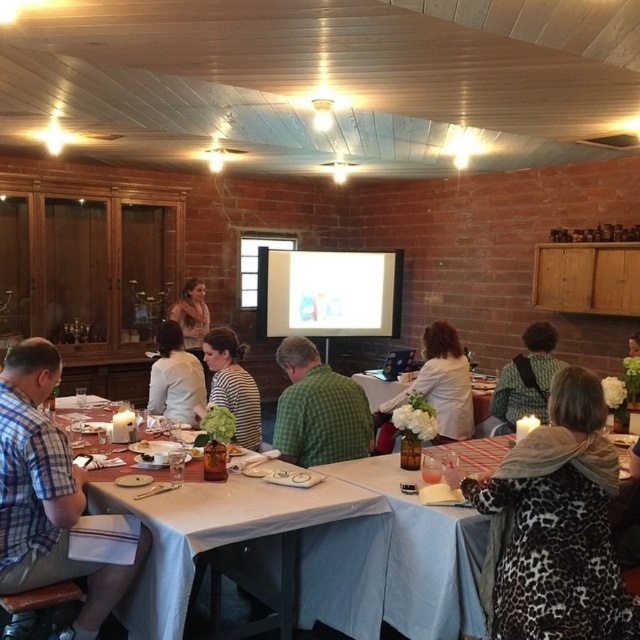
You are standing in the conference room and need to locate the person wearing the white shirt at center. According to the coordinates provided, where exactly is this person positioned?

The white shirt at center is located at point (173, 378), which means it is positioned slightly to the right and lower middle section of the image.

You are a guest at this event and want to place your phone on the table without it touching your clothing. Can you put it on the white fabric at center without it being under the matte brown shirt at center?

The white fabric at center is positioned under the matte brown shirt at center, so placing the phone there would result in it being under the shirt. Choose another spot on the table where the white fabric at center isn not covered by the matte brown shirt at center.

You are an event planner arranging seating for a photoshoot. You need to place two guests wearing the plaid shirt at left and the striped shirt at center so that one is not blocking the other. Based on the current arrangement, which guest should be seated closer to the camera to avoid overlap?

The plaid shirt at left is positioned under the striped shirt at center, so to avoid overlap, the striped shirt at center should be seated closer to the camera than the plaid shirt at left.